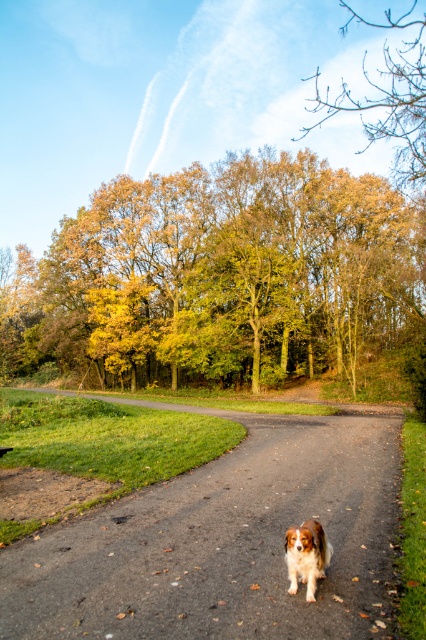
Between point (109, 241) and point (391, 536), which one is positioned in front?

Point (391, 536)

Is point (229, 236) in front of point (356, 452)?

No, (229, 236) is further to viewer.

Which is behind, point (207, 365) or point (166, 518)?

The point (207, 365) is more distant.

I want to click on yellow-green leaves at upper center, so click(x=221, y=276).

This screenshot has height=640, width=426. Describe the element at coordinates (221, 276) in the screenshot. I see `yellow-green leaves at upper center` at that location.

Is yellow-green leaves at upper center shorter than brown leafy tree at upper center?

Correct, yellow-green leaves at upper center is not as tall as brown leafy tree at upper center.

Which is behind, point (244, 326) or point (412, 12)?

The point (412, 12) is more distant.

The height and width of the screenshot is (640, 426). I want to click on yellow-green leaves at upper center, so click(x=221, y=276).

Is asphalt road at center to the left of brown and white fur dog at center from the viewer's perspective?

In fact, asphalt road at center is to the right of brown and white fur dog at center.

Is asphalt road at center thinner than brown and white fur dog at center?

Incorrect, asphalt road at center's width is not less than brown and white fur dog at center's.

The image size is (426, 640). Describe the element at coordinates (222, 541) in the screenshot. I see `asphalt road at center` at that location.

What are the coordinates of `asphalt road at center` in the screenshot? It's located at (222, 541).